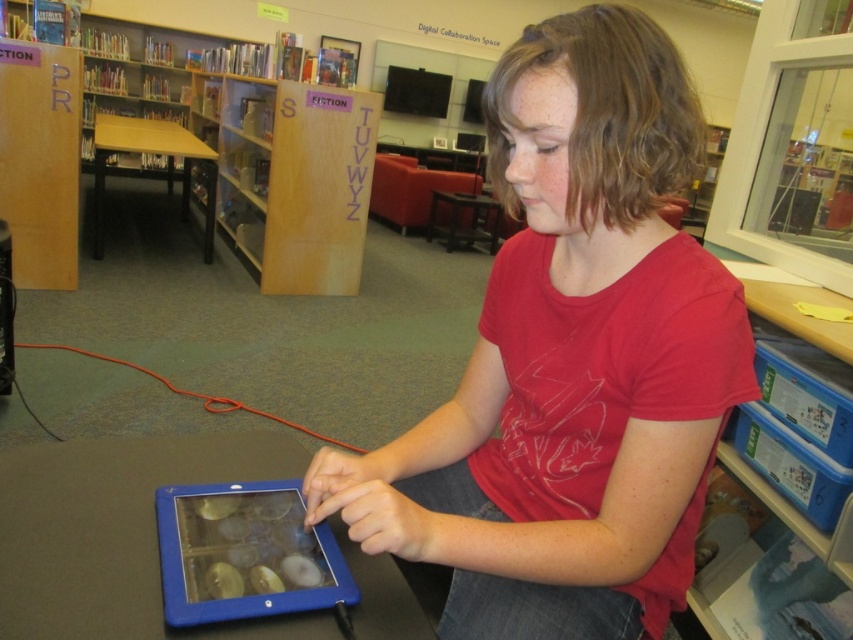
You are a photographer taking a picture of the scene. You notice two points in the image at coordinates point (369,497) and point (196,580). Which point will appear closer to the edges of the photo if the camera is positioned to capture the entire scene?

Point (196,580) will appear closer to the edges of the photo because it is closer to the camera compared to point (369,497), which is further away. Since the camera is capturing the entire scene, objects closer to the camera may be positioned towards the edges depending on their placement in the frame.

You are a student in the library who wants to place a pen between the matte red shirt at center and the blue rubberized tablet computer at center. Which side of the tablet should you place it on to be between them?

The matte red shirt at center is positioned on the right side of blue rubberized tablet computer at center, so you should place the pen on the right side of the blue rubberized tablet computer at center to be between them.

You are a tailor measuring the width of the matte red shirt at center and the blue rubberized tablet computer at center. Which item has a greater width?

The matte red shirt at center might be wider than blue rubberized tablet computer at center, so it is possible that the shirt is wider.